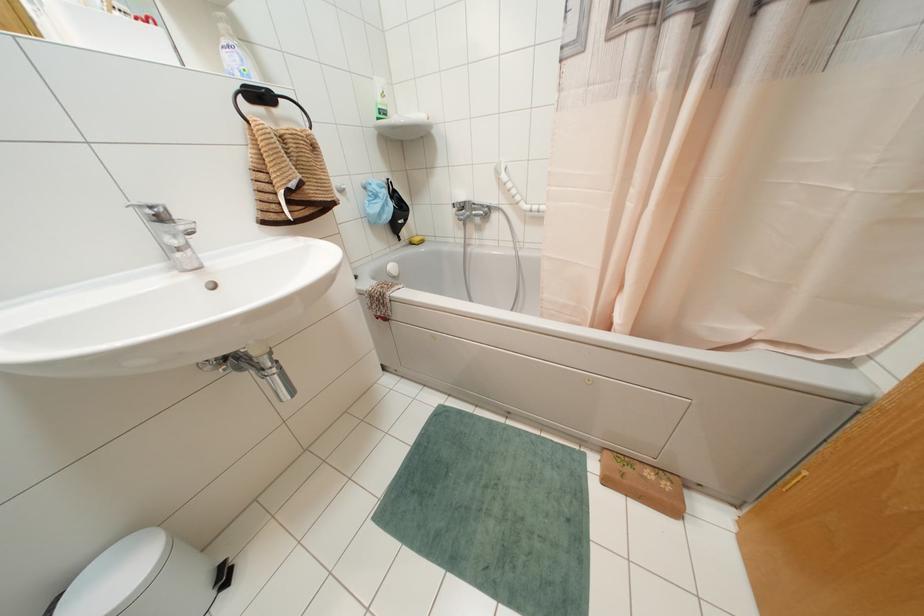
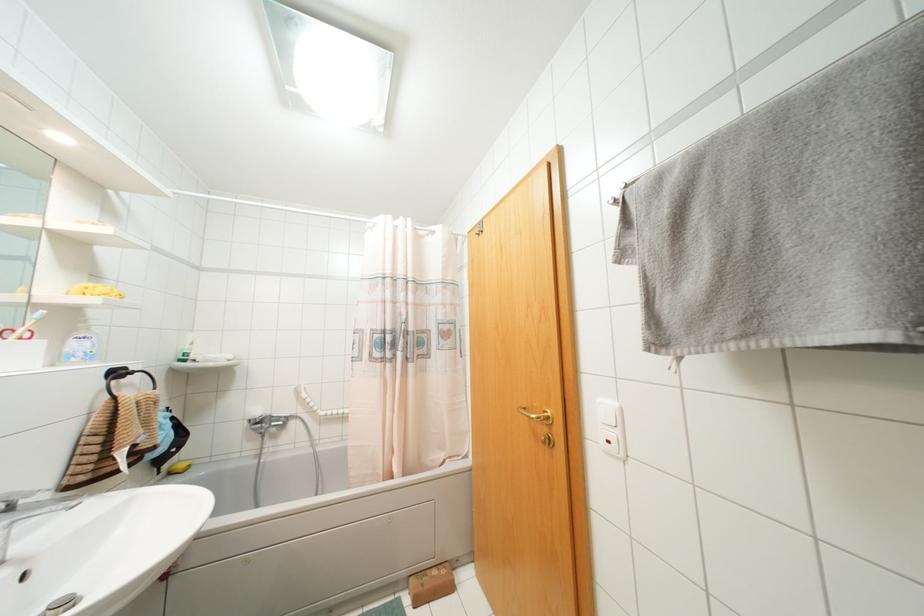
Find the pixel in the second image that matches [382,94] in the first image.

(190, 342)